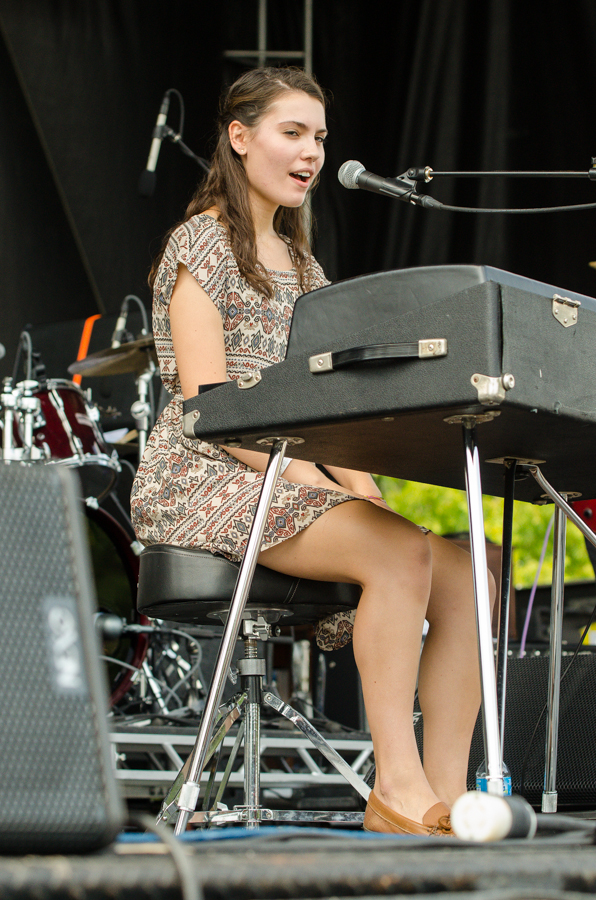
This screenshot has height=900, width=596. I want to click on place to sit, so coord(189,582).